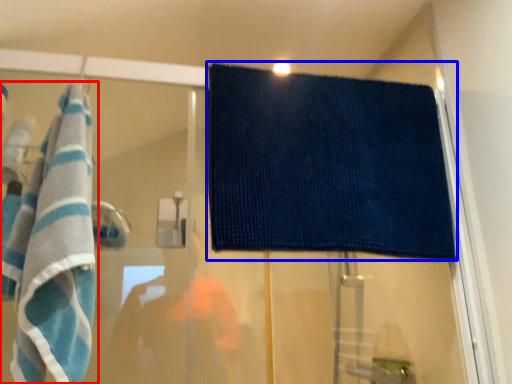
Question: Among these objects, which one is nearest to the camera, towel (highlighted by a red box) or towel (highlighted by a blue box)?

Choices:
 (A) towel
 (B) towel

Answer: (A)